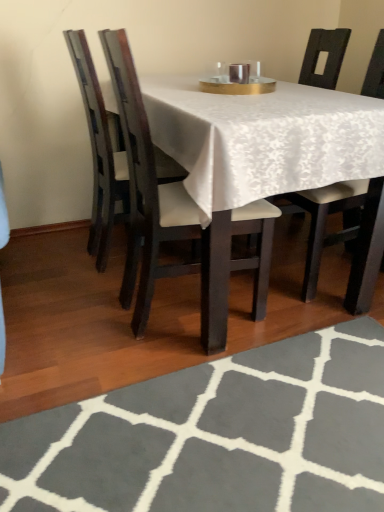
Image resolution: width=384 pixels, height=512 pixels. What are the coordinates of `free spot below gray woolen rug at lower center (from a real-world perspective)` in the screenshot? It's located at (253, 434).